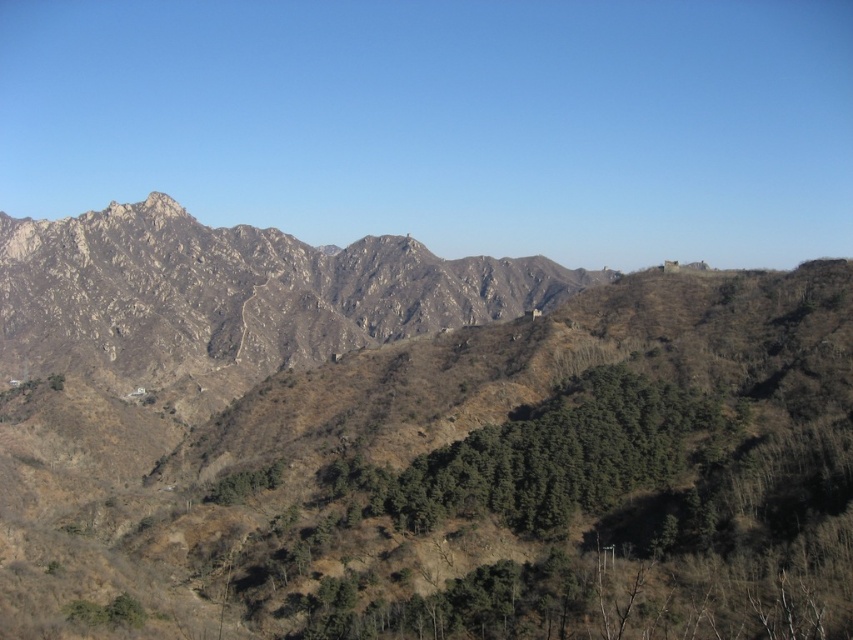
Which is more to the left, brown rocky mountain at center or rocky brown mountain range at center?

rocky brown mountain range at center

Is brown rocky mountain at center bigger than rocky brown mountain range at center?

Yes.

At what (x,y) coordinates should I click in order to perform the action: click on brown rocky mountain at center. Please return your answer as a coordinate pair (x, y). This screenshot has height=640, width=853. Looking at the image, I should click on (412, 442).

At what (x,y) coordinates should I click in order to perform the action: click on brown rocky mountain at center. Please return your answer as a coordinate pair (x, y). This screenshot has height=640, width=853. Looking at the image, I should click on (412, 442).